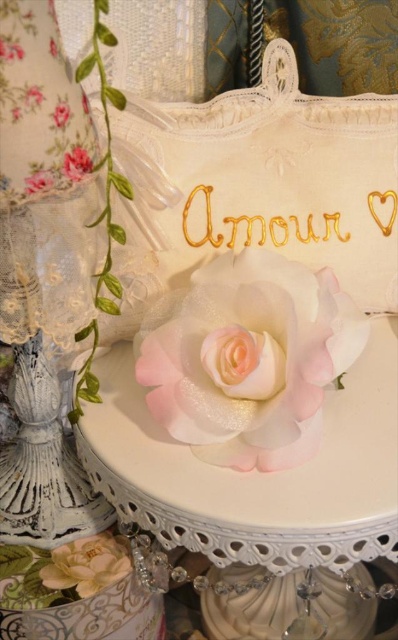
Is satin pink rose at center wider than pink satin rose at upper center?

Yes.

Is satin pink rose at center above pink satin rose at upper center?

No, satin pink rose at center is not above pink satin rose at upper center.

Identify the location of satin pink rose at center. (251, 358).

Is point (83, 556) positioned behind point (39, 182)?

That is True.

Can you confirm if matte white flower at lower left is taller than pink satin rose at upper left?

Yes.

This screenshot has width=398, height=640. What do you see at coordinates (87, 564) in the screenshot? I see `matte white flower at lower left` at bounding box center [87, 564].

I want to click on matte white flower at lower left, so click(x=87, y=564).

Is point (105, 573) behind point (76, 152)?

Yes, it is.

Between matte white flower at lower left and pink satin rose at upper center, which one appears on the right side from the viewer's perspective?

From the viewer's perspective, pink satin rose at upper center appears more on the right side.

Which is behind, point (126, 552) or point (76, 148)?

The point (126, 552) is behind.

Identify the location of matte white flower at lower left. (87, 564).